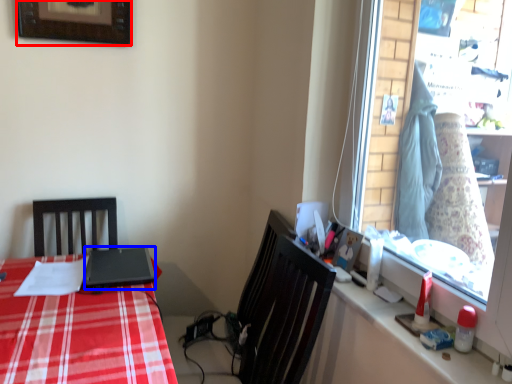
Question: Which object is closer to the camera taking this photo, picture frame (highlighted by a red box) or laptop (highlighted by a blue box)?

Choices:
 (A) picture frame
 (B) laptop

Answer: (B)